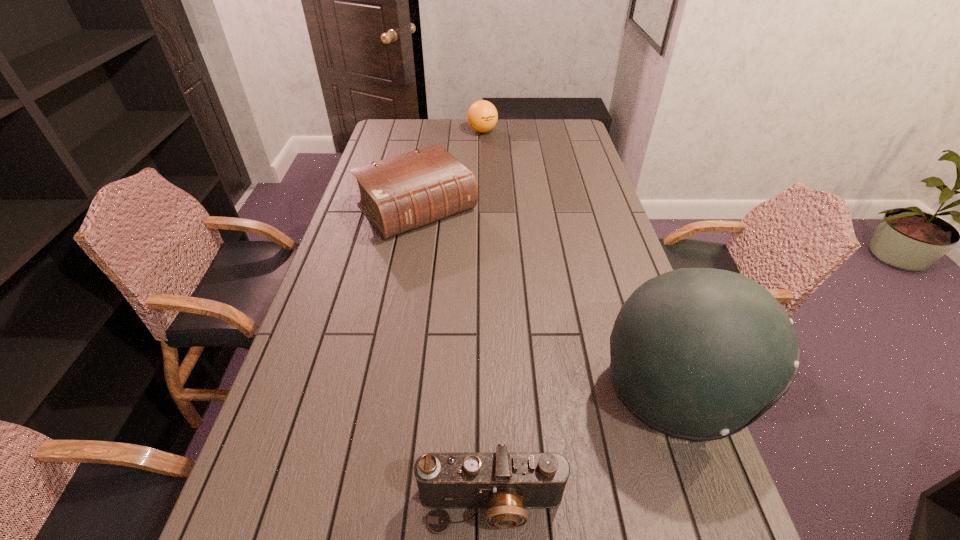
Locate an element on the screen. The width and height of the screenshot is (960, 540). free spot on the desktop that is between the camera and the tallest object and is positioned on the side with brand of the farthest object is located at coordinates (584, 448).

The height and width of the screenshot is (540, 960). What are the coordinates of `free space on the desktop that is between the nearest object and the second nearest object and is positioned on the spine side of the Bible` in the screenshot? It's located at (613, 429).